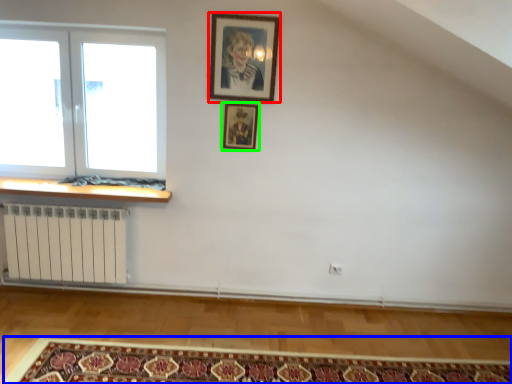
Question: Estimate the real-world distances between objects in this image. Which object is farther from picture frame (highlighted by a red box), mat (highlighted by a blue box) or picture frame (highlighted by a green box)?

Choices:
 (A) mat
 (B) picture frame

Answer: (A)